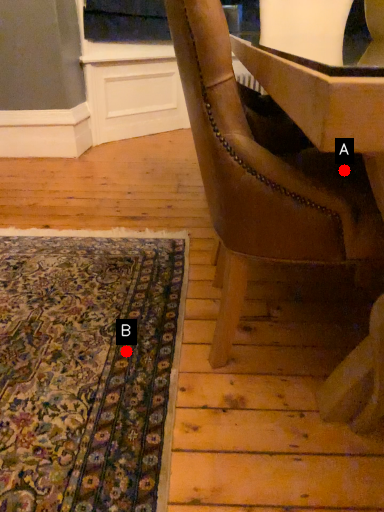
Question: Two points are circled on the image, labeled by A and B beside each circle. Which point appears farthest from the camera in this image?

Choices:
 (A) A is further
 (B) B is further

Answer: (B)